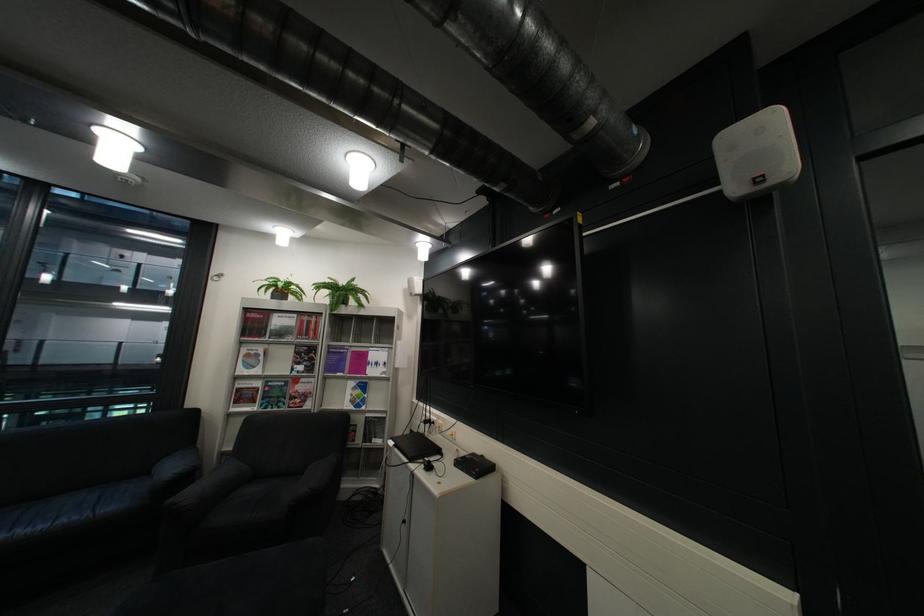
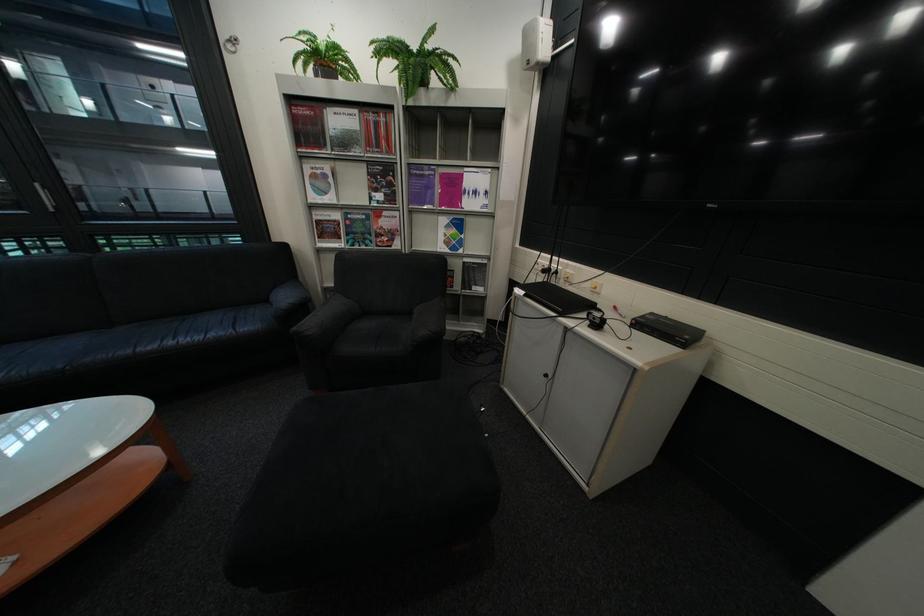
Locate, in the second image, the point that corresponds to [287,297] in the first image.

(333, 78)